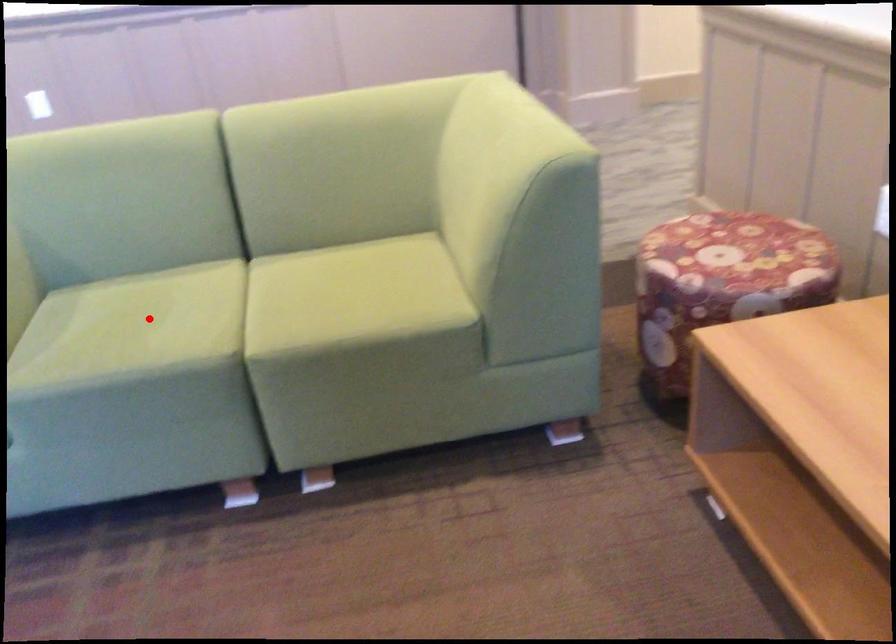
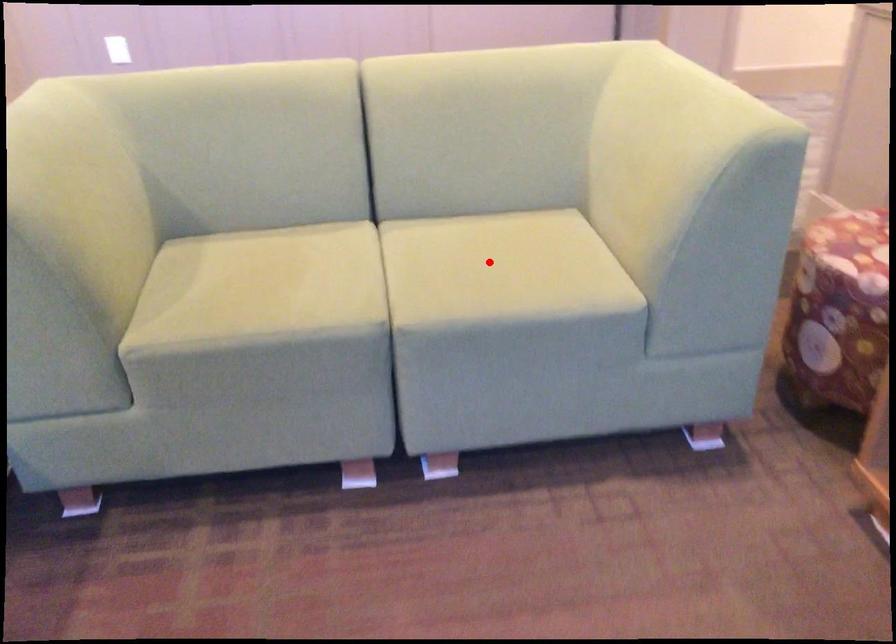
I am providing you with two images of the same scene from different viewpoints. A red point is marked on the first image and another point is marked on the second image. Do the highlighted points in image1 and image2 indicate the same real-world spot?

No